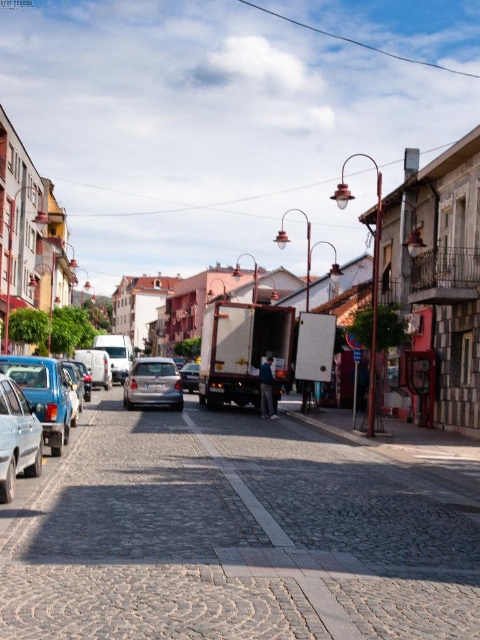
You are a delivery person trying to park your 2.5 meter wide van in this street. You see the metallic silver car at lower left and the satin silver car at center. Which parking spot between them can accommodate your van?

The satin silver car at center is wider than the metallic silver car at lower left. Therefore, the parking spot between the metallic silver car at lower left and the satin silver car at center can accommodate your 2.5 meter wide van if the space between them is sufficient. However, since the metallic silver car at lower left is narrower, the available space might be limited. It is recommended to measure the exact distance between them before deciding.

You are a delivery driver who needs to park your truck in this street. The truck is 6 meters long. The satin silver car at center and the matte silver sedan at center are blocking the way. Can you drive around them without moving the cars?

The satin silver car at center is larger in size than the matte silver sedan at center. Since the truck is 6 meters long, you can drive around the smaller matte silver sedan at center as there is enough space, but the larger satin silver car at center may block the path if it occupies too much of the narrow street. However, without knowing the exact dimensions of the cars and the street width, it is difficult to determine definitively.